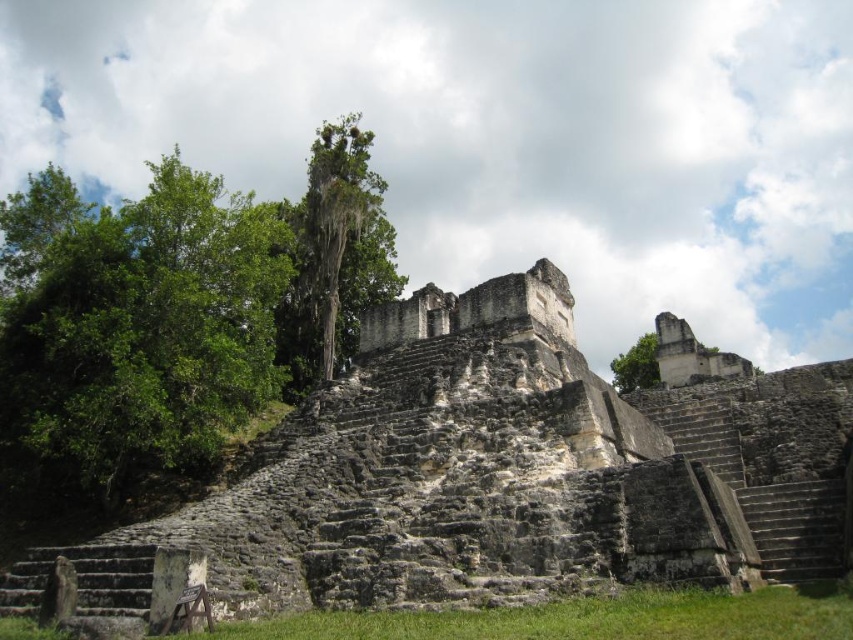
Question: Estimate the real-world distances between objects in this image. Which object is farther from the green leafy tree at left?

Choices:
 (A) green leafy tree at upper right
 (B) green mossy tree at center

Answer: (A)

Question: Based on their relative distances, which object is nearer to the green leafy tree at left?

Choices:
 (A) green leafy tree at upper right
 (B) green mossy tree at center

Answer: (B)

Question: Is green leafy tree at left above green leafy tree at upper right?

Choices:
 (A) yes
 (B) no

Answer: (A)

Question: Does green leafy tree at left have a smaller size compared to green leafy tree at upper right?

Choices:
 (A) no
 (B) yes

Answer: (A)

Question: Is green mossy tree at center to the left of green leafy tree at upper right from the viewer's perspective?

Choices:
 (A) no
 (B) yes

Answer: (B)

Question: Which point appears closest to the camera in this image?

Choices:
 (A) (628, 372)
 (B) (142, 337)
 (C) (320, 205)

Answer: (B)